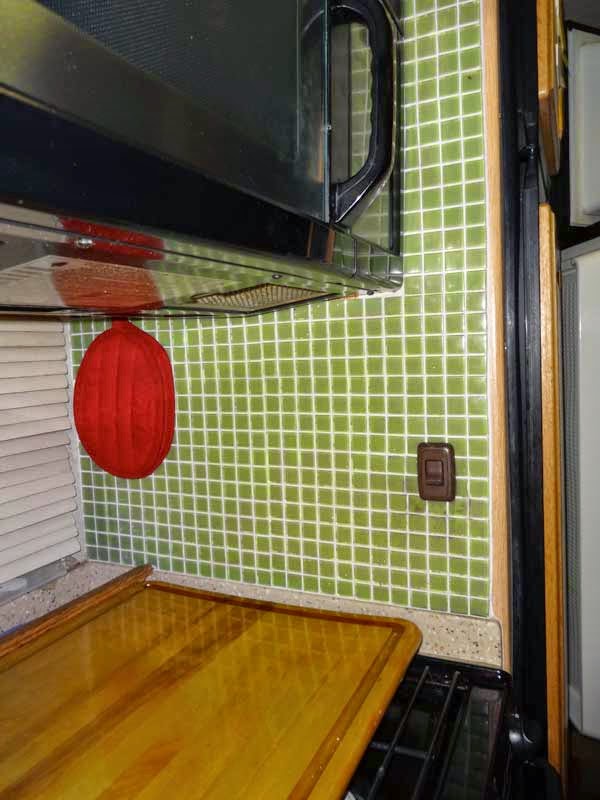
Where is `microwave door`? microwave door is located at coordinates (227, 65).